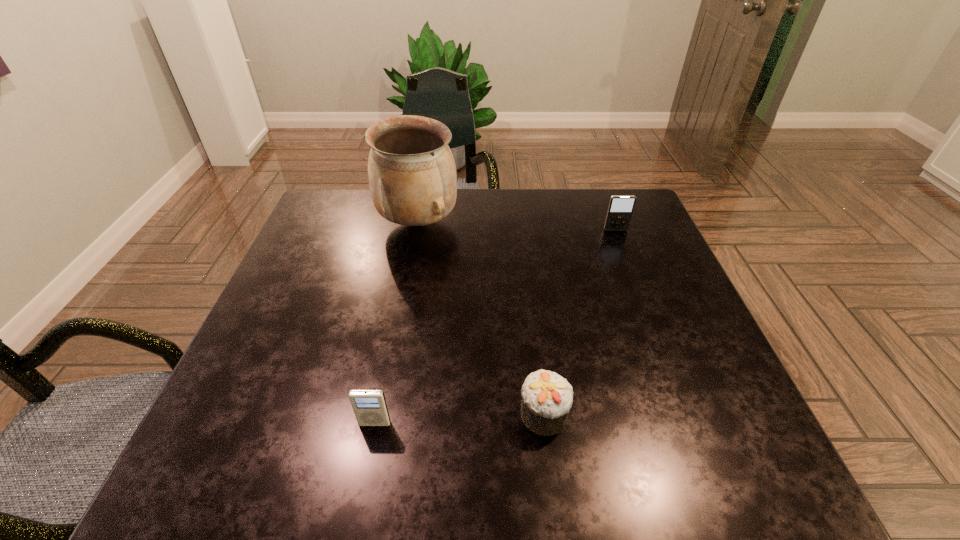
Where is `the tallest object`? The image size is (960, 540). the tallest object is located at coordinates (412, 176).

Find the location of `the right iPod`. the right iPod is located at coordinates (620, 209).

Find the location of a particular element. This screenshot has height=540, width=960. the rightmost object is located at coordinates (620, 209).

You are a GUI agent. You are given a task and a screenshot of the screen. Output one action in this format:
    pyautogui.click(x=<x>, y=<y>)
    Task: Click on the left iPod
    The width and height of the screenshot is (960, 540).
    Given the screenshot: What is the action you would take?
    pyautogui.click(x=369, y=406)

Identify the location of the second object from right to left. (546, 397).

Locate an element on the screen. free space located on the left of the tallest object is located at coordinates (352, 223).

The height and width of the screenshot is (540, 960). In order to click on free region located 0.260m on the front-facing side of the right iPod in this screenshot , I will do `click(641, 298)`.

Locate an element on the screen. free spot located 0.050m on the front-facing side of the left iPod is located at coordinates (369, 454).

You are a GUI agent. You are given a task and a screenshot of the screen. Output one action in this format:
    pyautogui.click(x=<x>, y=<y>)
    Task: Click on the vacant point located 0.180m on the back of the third object from left to right
    The width and height of the screenshot is (960, 540).
    Given the screenshot: What is the action you would take?
    pyautogui.click(x=533, y=321)

You are a GUI agent. You are given a task and a screenshot of the screen. Output one action in this format:
    pyautogui.click(x=<x>, y=<y>)
    Task: Click on the urn located in the far edge section of the desktop
    
    Given the screenshot: What is the action you would take?
    pyautogui.click(x=412, y=176)